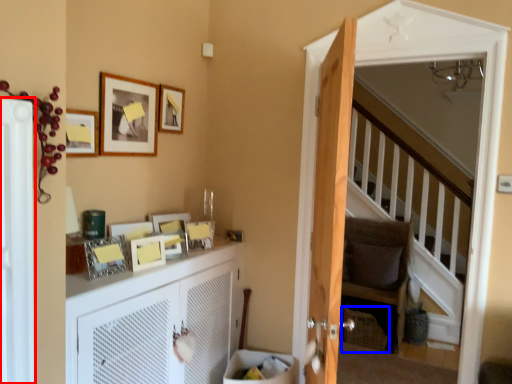
Question: Which object appears closest to the camera in this image, screen door (highlighted by a red box) or basket (highlighted by a blue box)?

Choices:
 (A) screen door
 (B) basket

Answer: (A)